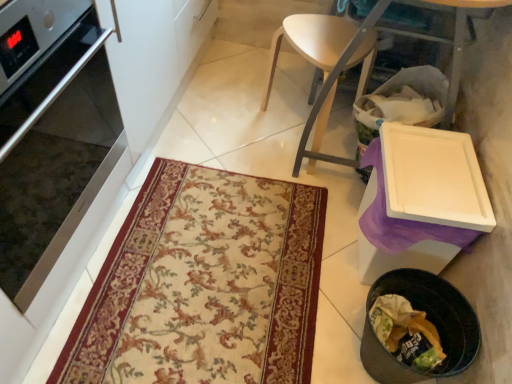
Where is `free space above beige floral rug at center (from a real-world perspective)`? free space above beige floral rug at center (from a real-world perspective) is located at coordinates (215, 260).